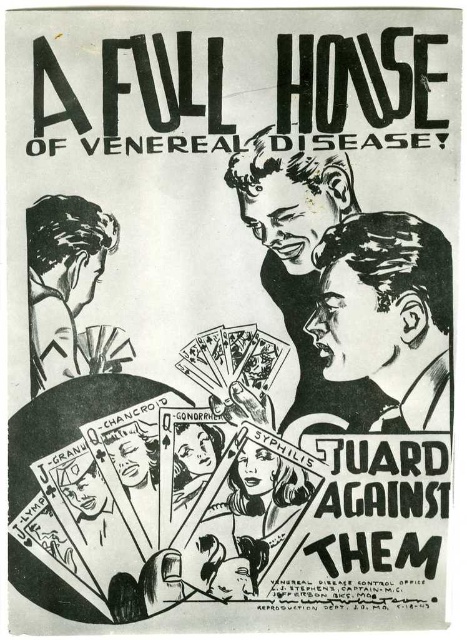
In the scene shown: You are an art student analyzing the spatial arrangement in the image. You notice the black ink drawing of man at center and the smooth black hair at left. Which object is positioned closer to you?

The black ink drawing of man at center is closer to the viewer than smooth black hair at left.

You are a public health official analyzing the image for a presentation. You need to point out the spatial relationship between the smooth black face at lower right and the black ink drawing of man at center. Which one is positioned lower in the image?

The smooth black face at lower right is positioned lower than the black ink drawing of man at center.